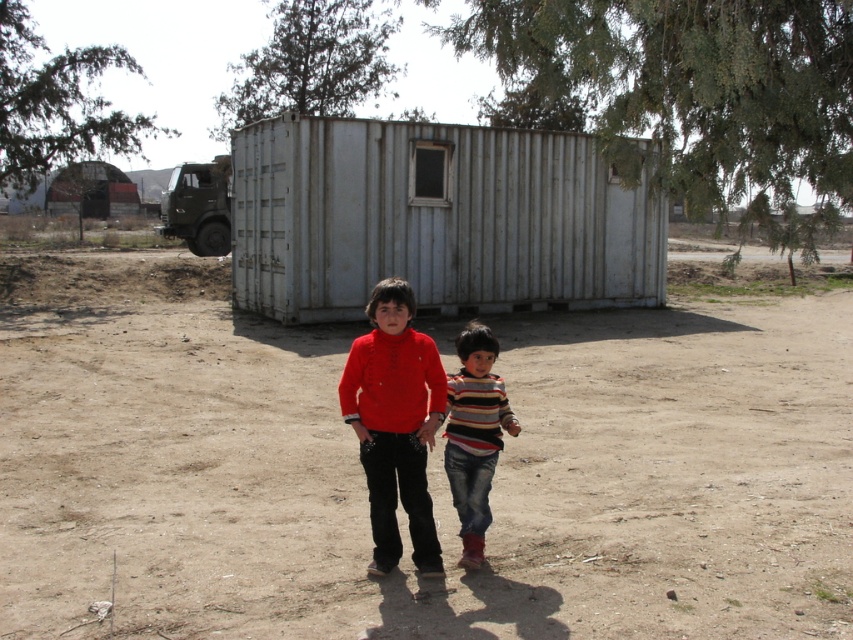
You are a delivery person trying to park your truck between the white corrugated metal container at center and the rustic corrugated metal hut at upper center. The truck is 2 meters wide. Can you fit the truck between them?

The white corrugated metal container at center is thinner than rustic corrugated metal hut at upper center, so the space between them is sufficient for the truck to fit as long as the truck is within the width capacity. Since the truck is 2 meters wide, it can fit if the available space is at least 2 meters wide.

You are planning to set up a small garden between the white corrugated metal container at center and the rustic corrugated metal hut at upper center. Based on their positions, which structure should you place the garden closer to in order to ensure it receives maximum sunlight throughout the day?

The white corrugated metal container at center is positioned under the rustic corrugated metal hut at upper center, so the garden should be placed closer to the white corrugated metal container at center to avoid the shadow cast by the rustic corrugated metal hut at upper center.

You are a photographer trying to capture both the striped fabric shirt at center and the rustic corrugated metal hut at upper center in a single frame. Based on their sizes in the image, which object should you focus on to ensure both are clearly visible?

The striped fabric shirt at center occupies less space than rustic corrugated metal hut at upper center, so you should focus on the rustic corrugated metal hut at upper center to ensure both are clearly visible.